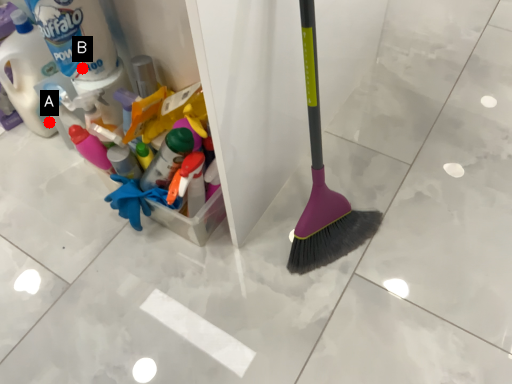
Question: Two points are circled on the image, labeled by A and B beside each circle. Which point is closer to the camera taking this photo?

Choices:
 (A) A is closer
 (B) B is closer

Answer: (B)